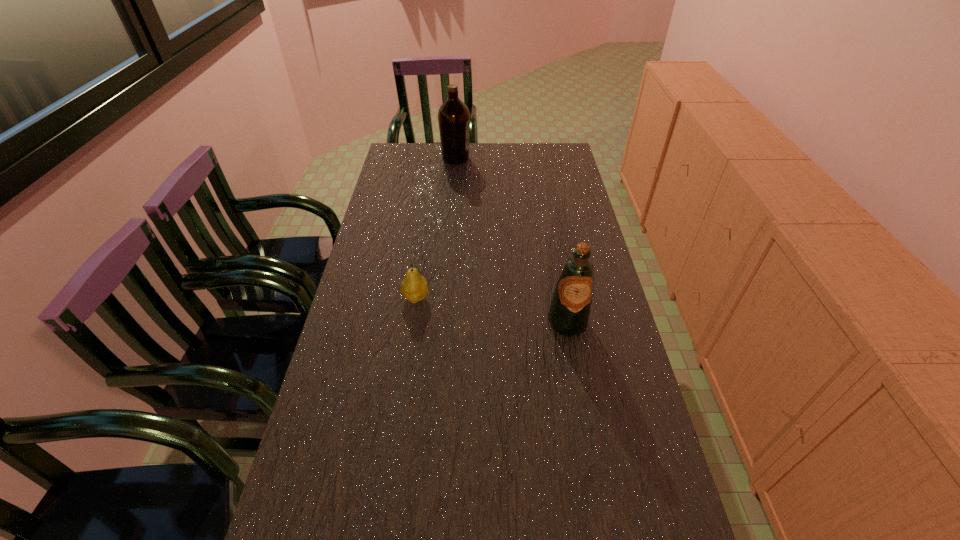
Locate an element on the screen. The image size is (960, 540). object positioned at the right edge is located at coordinates (570, 310).

You are a GUI agent. You are given a task and a screenshot of the screen. Output one action in this format:
    pyautogui.click(x=<x>, y=<y>)
    Task: Click on the vacant space at the far edge of the desktop
    The height and width of the screenshot is (540, 960).
    Given the screenshot: What is the action you would take?
    pyautogui.click(x=450, y=169)

In the image, there is a desktop. Where is `vacant space at the left edge`? vacant space at the left edge is located at coordinates (390, 236).

Where is `vacant region at the right edge of the desktop`? vacant region at the right edge of the desktop is located at coordinates (588, 218).

I want to click on free point at the far right corner, so (540, 169).

Where is `vacant region between the rightmost object and the pear`? vacant region between the rightmost object and the pear is located at coordinates (492, 310).

Find the location of `vacant area that lies between the farthest object and the pear`. vacant area that lies between the farthest object and the pear is located at coordinates (436, 228).

What are the coordinates of `vacant area that lies between the pear and the farther olive oil` in the screenshot? It's located at (436, 228).

Find the location of a particular element. Image resolution: width=960 pixels, height=540 pixels. object that stands as the second closest to the left olive oil is located at coordinates (570, 310).

Locate an element on the screen. The image size is (960, 540). the second closest object relative to the left olive oil is located at coordinates (570, 310).